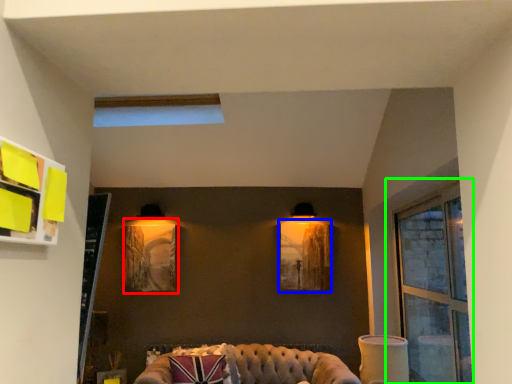
Question: Estimate the real-world distances between objects in this image. Which object is farther from picture frame (highlighted by a red box), picture frame (highlighted by a blue box) or window (highlighted by a green box)?

Choices:
 (A) picture frame
 (B) window

Answer: (B)